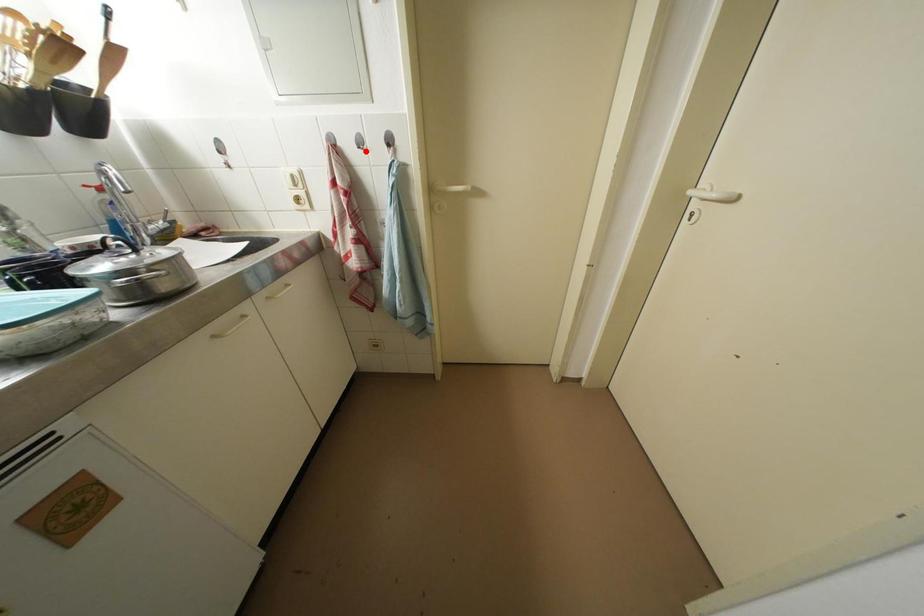
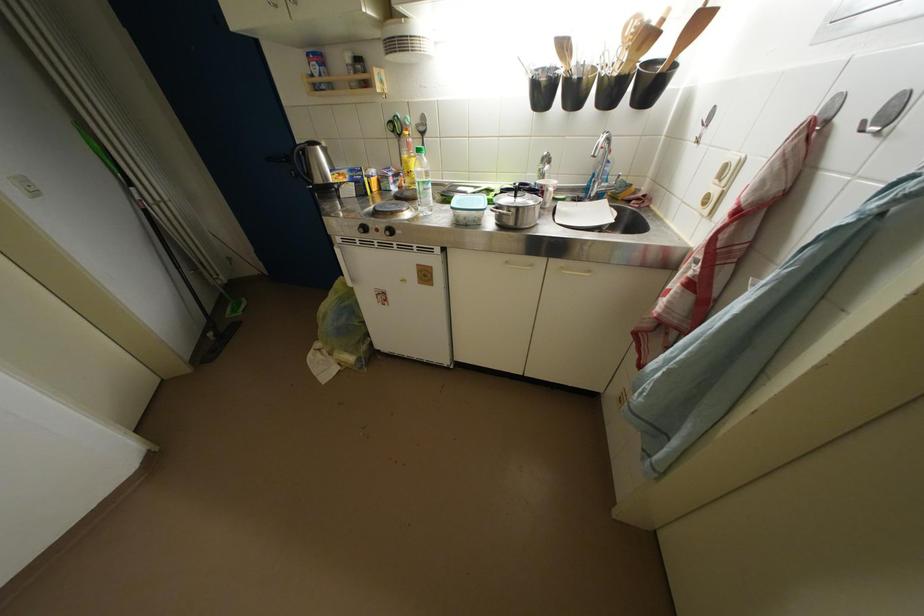
Question: I am providing you with two images of the same scene from different viewpoints. Given a red point in image1, look at the same physical point in image2. Is it:

Choices:
 (A) Closer to the viewpoint
 (B) Farther from the viewpoint

Answer: (B)